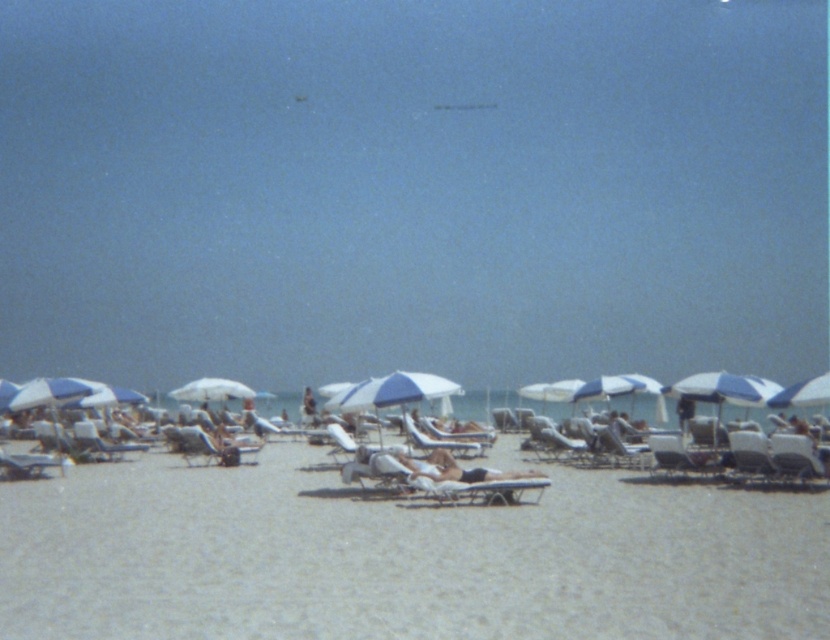
Question: Can you confirm if metallic silver lounge chair at lower left is positioned above matte white lounge chair at center?

Choices:
 (A) no
 (B) yes

Answer: (A)

Question: Which is farther from the white fabric umbrella at center?

Choices:
 (A) metallic silver lounge chair at lower left
 (B) matte white beach chair at center

Answer: (B)

Question: Is metallic silver lounge chair at lower left thinner than matte white lounge chair at center?

Choices:
 (A) no
 (B) yes

Answer: (A)

Question: Which of the following is the closest to the observer?

Choices:
 (A) (359, 504)
 (B) (618, 460)
 (C) (203, 388)

Answer: (A)

Question: Can you confirm if white plastic chair at center is positioned below matte white beach chair at center?

Choices:
 (A) no
 (B) yes

Answer: (B)

Question: Which point is farther to the camera?

Choices:
 (A) (633, 461)
 (B) (658, 468)
 (C) (206, 394)
 (D) (129, 449)

Answer: (C)